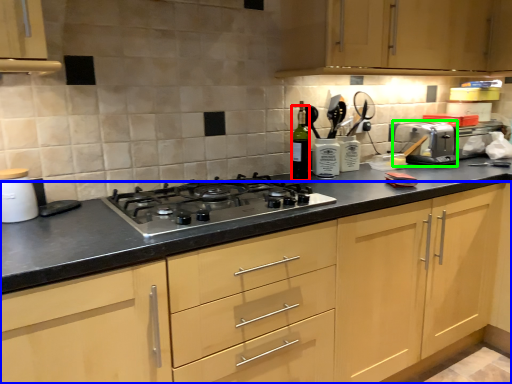
Question: Considering the real-world distances, which object is farthest from bottle (highlighted by a red box)? cabinetry (highlighted by a blue box) or toaster (highlighted by a green box)?

Choices:
 (A) cabinetry
 (B) toaster

Answer: (B)